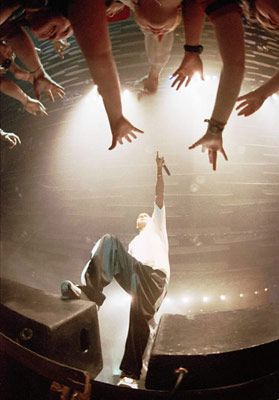
This screenshot has width=279, height=400. In order to click on left speaker in this screenshot , I will do `click(39, 317)`.